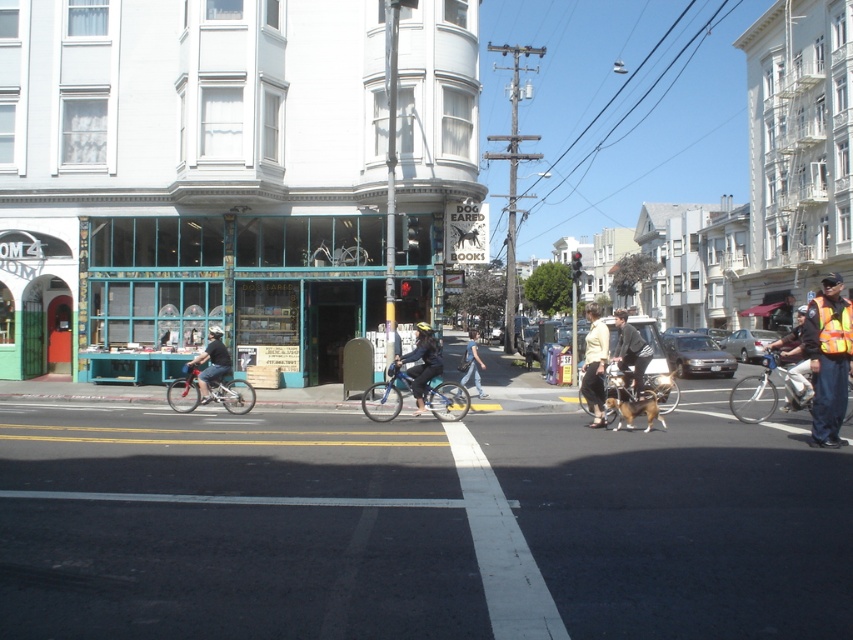
You are standing at the camera position observing the blue matte bicycle at center. The road ahead has a speed limit of 20 km per hour. If you start moving towards the bicycle at a constant speed of 5 km per hour, how many minutes will it take you to reach the bicycle?

The blue matte bicycle at center and camera are 14.93 meters apart. To calculate the time, convert 5 km per hour to meters per minute which is approximately 83.33 meters per minute. Divide the distance 14.93 meters by 83.33 meters per minute, resulting in approximately 0.18 minutes, or about 11 seconds.

You are a delivery person needing to carry a package that requires a space of 1.2 meters in width. You see a blue matte bicycle at center and a light yellow shirt at center. Which object can accommodate the package based on their widths?

The light yellow shirt at center has a greater width than the blue matte bicycle at center, so the package can be accommodated on the light yellow shirt at center.